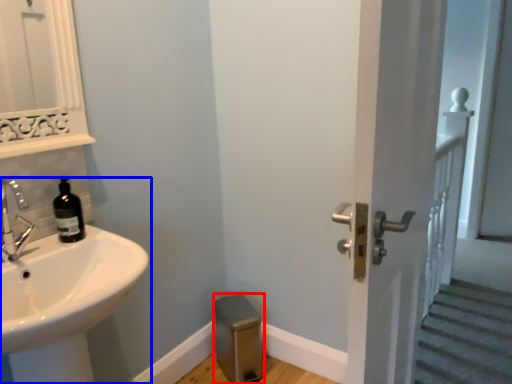
Question: Which object is closer to the camera taking this photo, step stool (highlighted by a red box) or sink (highlighted by a blue box)?

Choices:
 (A) step stool
 (B) sink

Answer: (B)